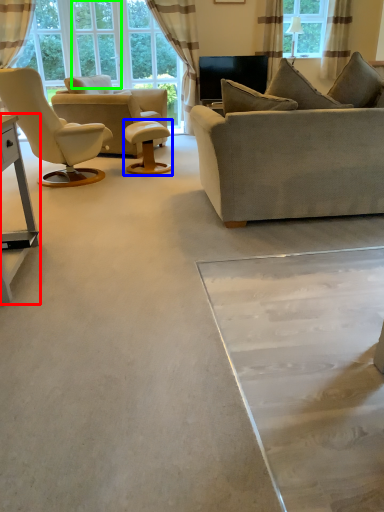
Question: Which object is the farthest from table (highlighted by a red box)? Choose among these: round table (highlighted by a blue box) or glass door (highlighted by a green box).

Choices:
 (A) round table
 (B) glass door

Answer: (B)